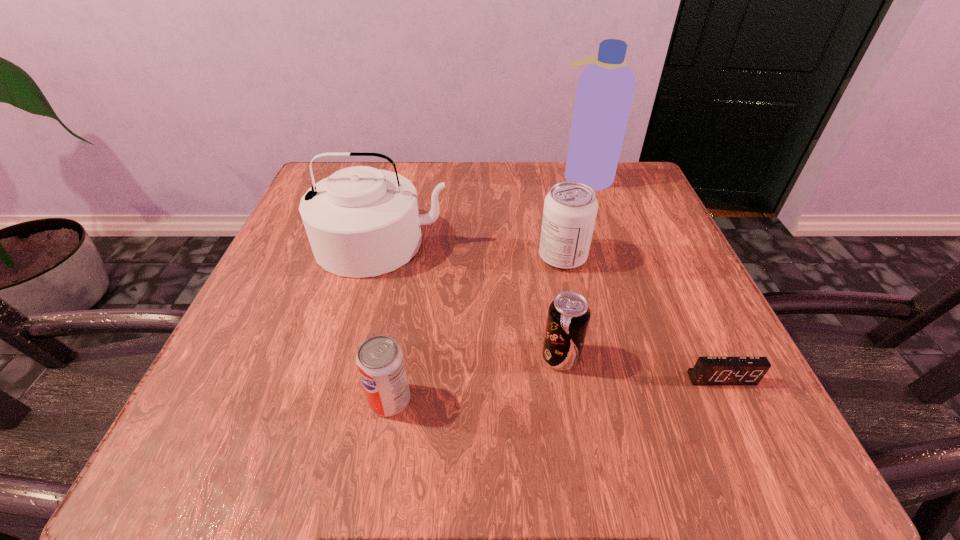
You are a GUI agent. You are given a task and a screenshot of the screen. Output one action in this format:
    pyautogui.click(x=<x>, y=<y>)
    Task: Click on the free location located 0.170m on the left of the tallest soda
    The image size is (960, 540).
    Given the screenshot: What is the action you would take?
    pyautogui.click(x=448, y=257)

Where is `free region located on the right of the second nearest soda`? This screenshot has height=540, width=960. free region located on the right of the second nearest soda is located at coordinates (707, 357).

You are a GUI agent. You are given a task and a screenshot of the screen. Output one action in this format:
    pyautogui.click(x=<x>, y=<y>)
    Task: Click on the vacant space situated 0.280m on the back of the leftmost soda
    
    Given the screenshot: What is the action you would take?
    pos(415,255)

Locate an element on the screen. The image size is (960, 540). free space located 0.060m on the front-facing side of the shortest object is located at coordinates (743, 425).

The width and height of the screenshot is (960, 540). In order to click on shampoo at the far edge in this screenshot , I will do `click(605, 89)`.

The height and width of the screenshot is (540, 960). Find the location of `kettle at the far edge`. kettle at the far edge is located at coordinates (361, 221).

Image resolution: width=960 pixels, height=540 pixels. Identify the location of object that is at the near edge. (380, 362).

You are a GUI agent. You are given a task and a screenshot of the screen. Output one action in this format:
    pyautogui.click(x=<x>, y=<y>)
    Task: Click on the object present at the left edge
    The width and height of the screenshot is (960, 540).
    Given the screenshot: What is the action you would take?
    pyautogui.click(x=361, y=221)

In order to click on shampoo that is at the right edge in this screenshot , I will do `click(605, 89)`.

Identify the location of alarm clock positioned at the right edge. (708, 370).